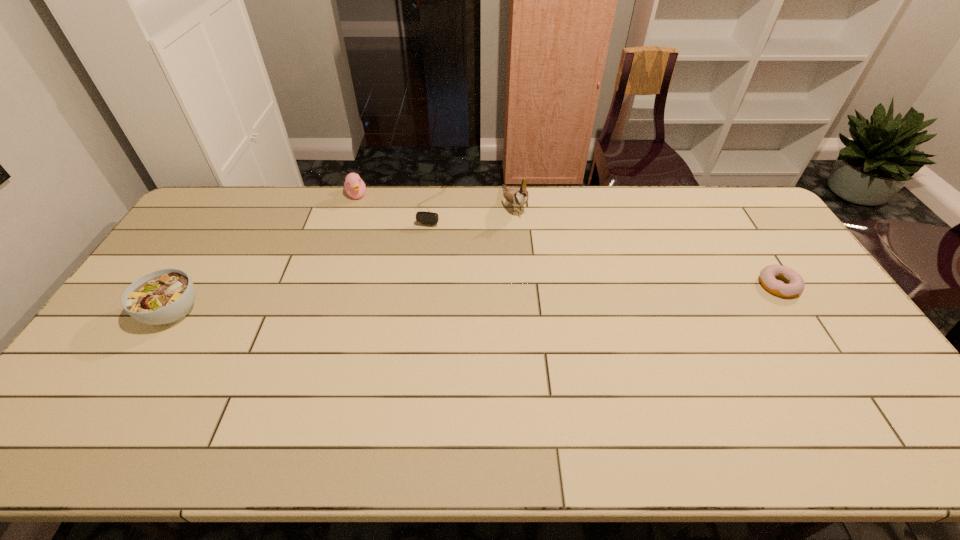
This screenshot has width=960, height=540. Find the location of `unoccupied area between the second object from left to right and the leftmost object`. unoccupied area between the second object from left to right and the leftmost object is located at coordinates (265, 254).

This screenshot has height=540, width=960. What are the coordinates of `free spot between the leftmost object and the webcam` in the screenshot? It's located at (302, 260).

Where is `vacant region between the leftmost object and the fourth tallest object`? The width and height of the screenshot is (960, 540). vacant region between the leftmost object and the fourth tallest object is located at coordinates (302, 260).

Identify the location of free spot between the rightmost object and the soup bowl. (475, 299).

Locate an element on the screen. free area in between the fourth tallest object and the duckling is located at coordinates (394, 201).

At what (x,y) coordinates should I click in order to perform the action: click on unoccupied area between the duckling and the leftmost object. Please return your answer as a coordinate pair (x, y). The height and width of the screenshot is (540, 960). Looking at the image, I should click on (265, 254).

I want to click on unoccupied area between the third object from right to left and the tallest object, so click(472, 206).

Image resolution: width=960 pixels, height=540 pixels. In order to click on unoccupied position between the rightmost object and the duckling in this screenshot , I will do `click(567, 240)`.

Find the location of a particular element. free area in between the leftmost object and the tallest object is located at coordinates (344, 259).

Select which object is the fourth closest to the third object from left to right. Please provide its 2D coordinates. Your answer should be formatted as a tuple, i.e. [(x, y)], where the tuple contains the x and y coordinates of a point satisfying the conditions above.

[(768, 275)]